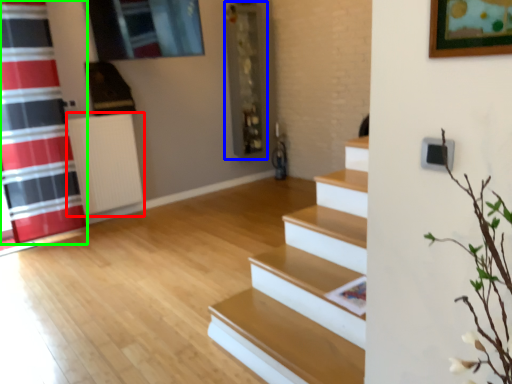
Question: Which object is positioned farthest from radiator (highlighted by a red box)? Select from shelf (highlighted by a blue box) and shower curtain (highlighted by a green box).

Choices:
 (A) shelf
 (B) shower curtain

Answer: (A)